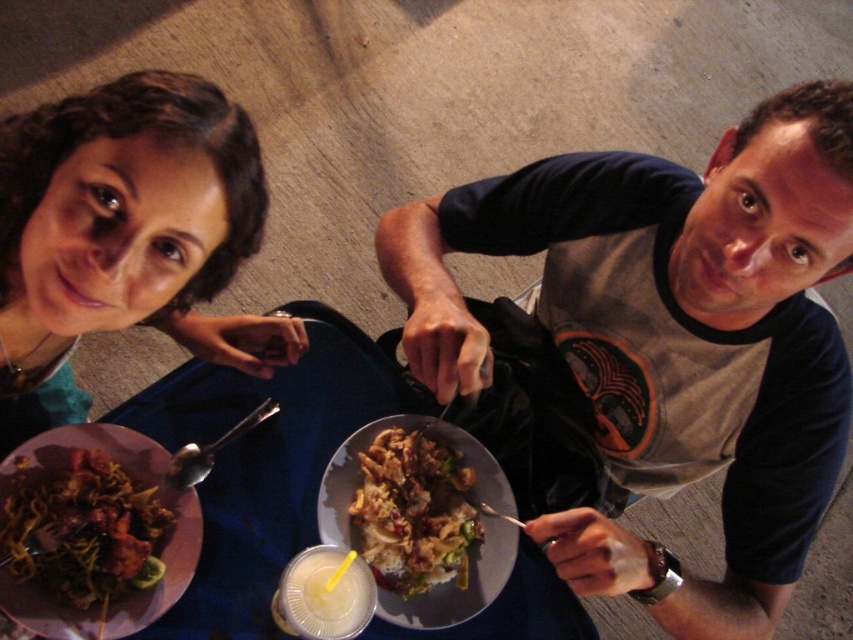
Question: Which point is closer to the camera?

Choices:
 (A) shiny metallic plate at lower left
 (B) shiny brown meat at center
 (C) matte teal shirt at upper left

Answer: (C)

Question: Which object is the farthest from the gray cotton t-shirt at upper right?

Choices:
 (A) shiny metallic plate at lower left
 (B) shiny brown meat at center
 (C) blue fabric table at center

Answer: (A)

Question: Is matte teal shirt at upper left behind shiny brown meat at center?

Choices:
 (A) no
 (B) yes

Answer: (A)

Question: Does matte teal shirt at upper left appear under blue fabric table at center?

Choices:
 (A) yes
 (B) no

Answer: (B)

Question: Which point is closer to the camera taking this photo?

Choices:
 (A) (376, 356)
 (B) (521, 442)

Answer: (B)

Question: Is the position of matte teal shirt at upper left more distant than that of blue fabric table at center?

Choices:
 (A) yes
 (B) no

Answer: (B)